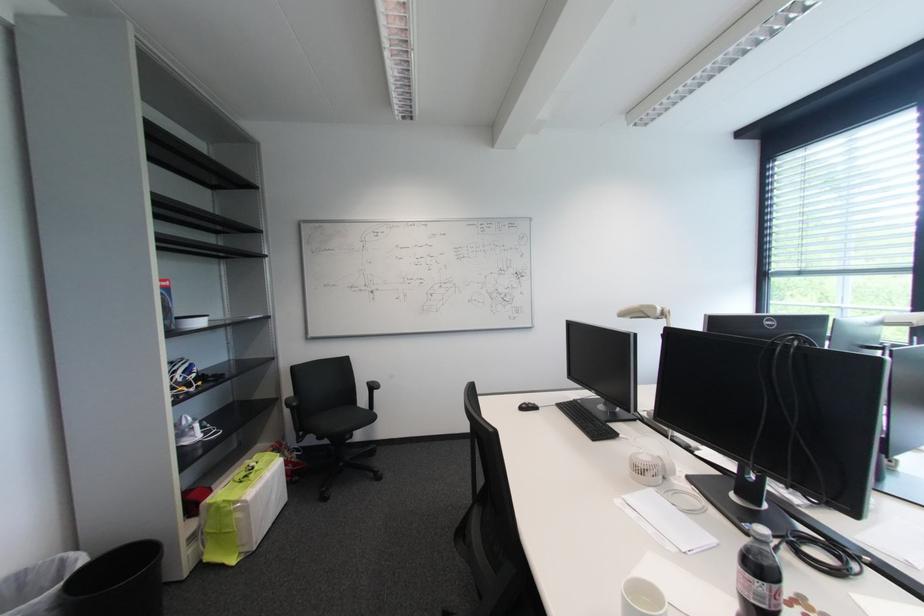
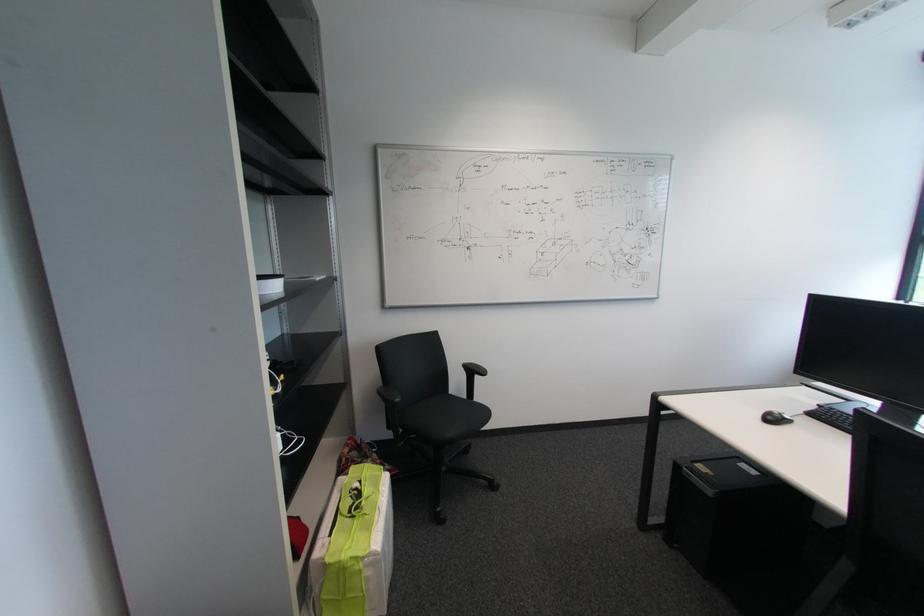
In the second image, find the point that corresponds to [231,503] in the first image.

(358, 560)